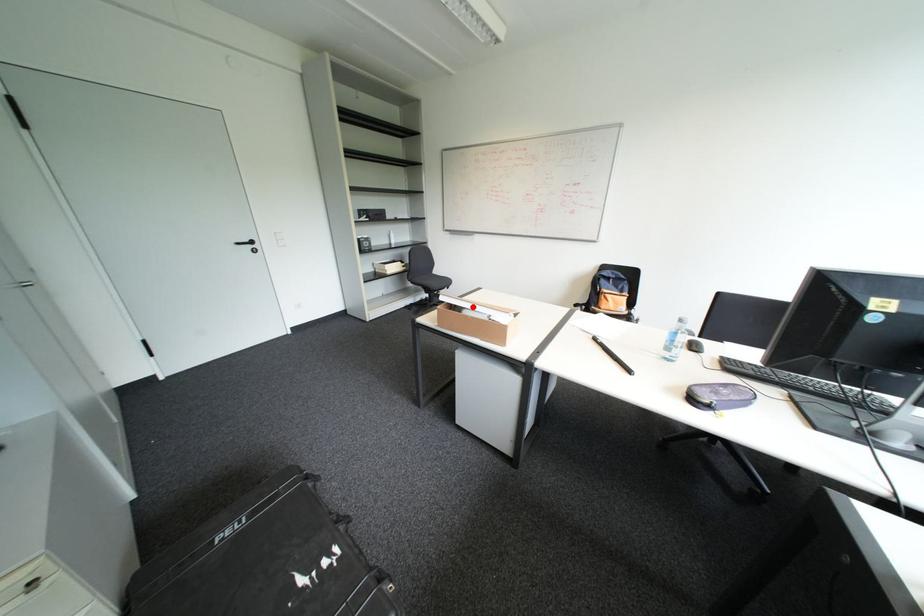
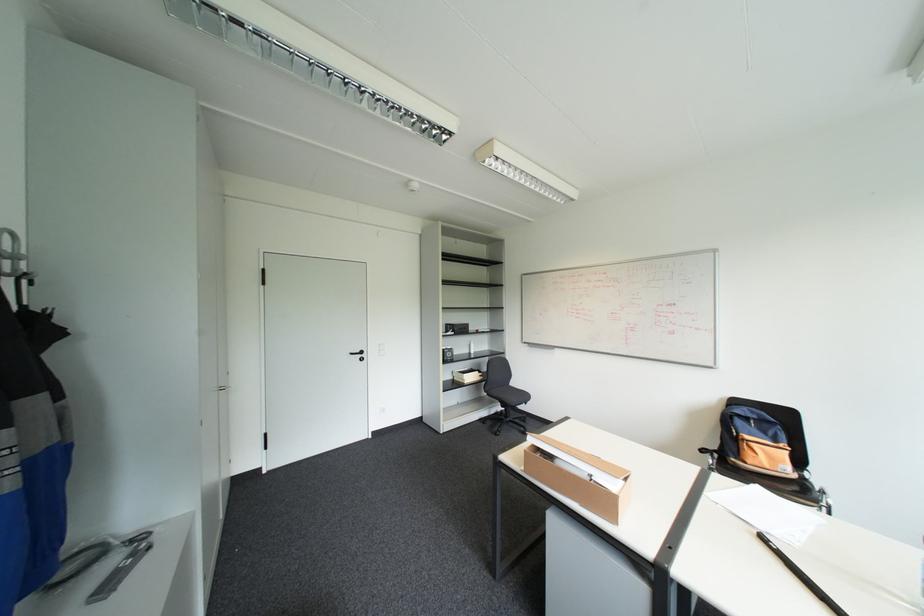
Locate, in the second image, the point that corresponds to the highlighted location in the first image.

(565, 455)